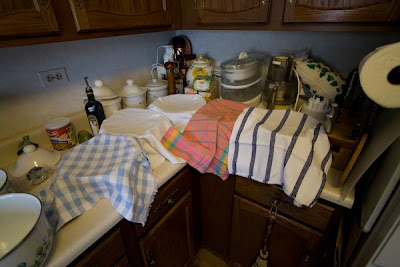
What are the coordinates of `pepper grinder` in the screenshot? It's located at (170, 66).